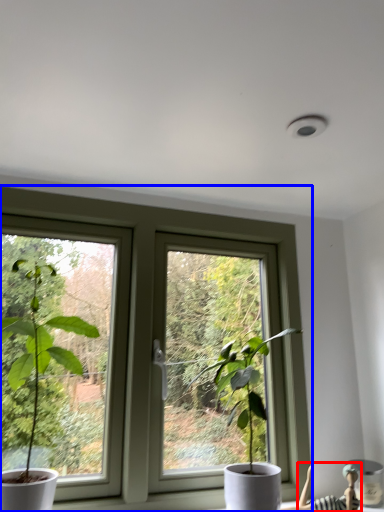
Question: Among these objects, which one is nearest to the camera, couple (highlighted by a red box) or window (highlighted by a blue box)?

Choices:
 (A) couple
 (B) window

Answer: (B)